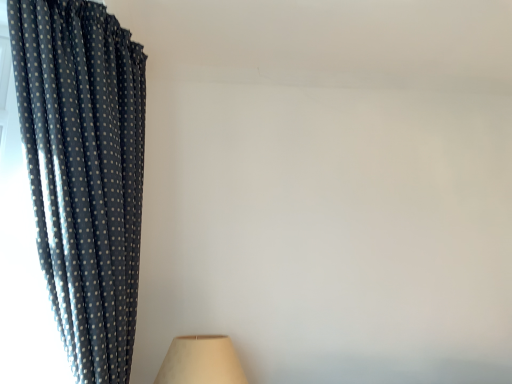
Question: Is beige fabric lampshade at lower left at the right side of dark blue polka dot fabric at left?

Choices:
 (A) yes
 (B) no

Answer: (A)

Question: Is beige fabric lampshade at lower left shorter than dark blue polka dot fabric at left?

Choices:
 (A) yes
 (B) no

Answer: (A)

Question: From a real-world perspective, is beige fabric lampshade at lower left located higher than dark blue polka dot fabric at left?

Choices:
 (A) no
 (B) yes

Answer: (A)

Question: Is beige fabric lampshade at lower left positioned before dark blue polka dot fabric at left?

Choices:
 (A) yes
 (B) no

Answer: (B)

Question: Is beige fabric lampshade at lower left bigger than dark blue polka dot fabric at left?

Choices:
 (A) yes
 (B) no

Answer: (B)

Question: Is beige fabric lampshade at lower left to the left of dark blue polka dot fabric at left from the viewer's perspective?

Choices:
 (A) no
 (B) yes

Answer: (A)

Question: Is the surface of dark blue polka dot fabric at left in direct contact with beige fabric lampshade at lower left?

Choices:
 (A) yes
 (B) no

Answer: (B)

Question: From a real-world perspective, does dark blue polka dot fabric at left sit lower than beige fabric lampshade at lower left?

Choices:
 (A) yes
 (B) no

Answer: (B)

Question: Is dark blue polka dot fabric at left not near beige fabric lampshade at lower left?

Choices:
 (A) yes
 (B) no

Answer: (B)

Question: Can you confirm if dark blue polka dot fabric at left is wider than beige fabric lampshade at lower left?

Choices:
 (A) no
 (B) yes

Answer: (B)

Question: Is dark blue polka dot fabric at left looking in the opposite direction of beige fabric lampshade at lower left?

Choices:
 (A) yes
 (B) no

Answer: (B)

Question: Would you say dark blue polka dot fabric at left is outside beige fabric lampshade at lower left?

Choices:
 (A) no
 (B) yes

Answer: (B)

Question: From a real-world perspective, is dark blue polka dot fabric at left physically located above or below beige fabric lampshade at lower left?

Choices:
 (A) below
 (B) above

Answer: (B)